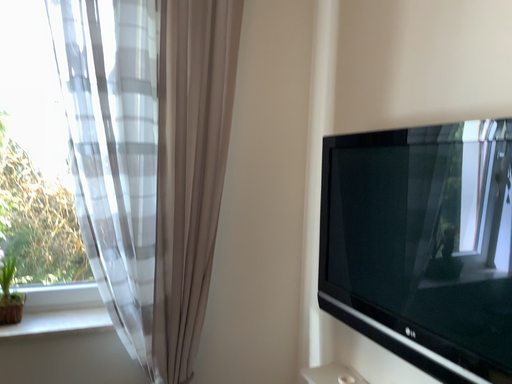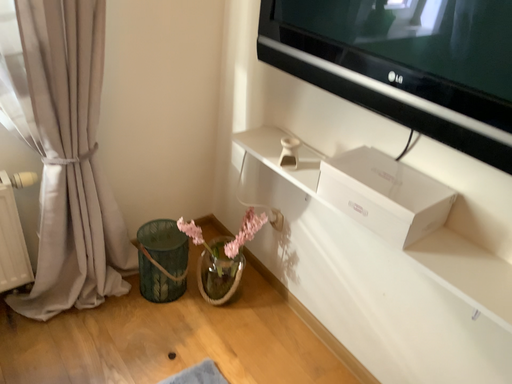
Question: Which way did the camera rotate in the video?

Choices:
 (A) rotated right
 (B) rotated left

Answer: (A)